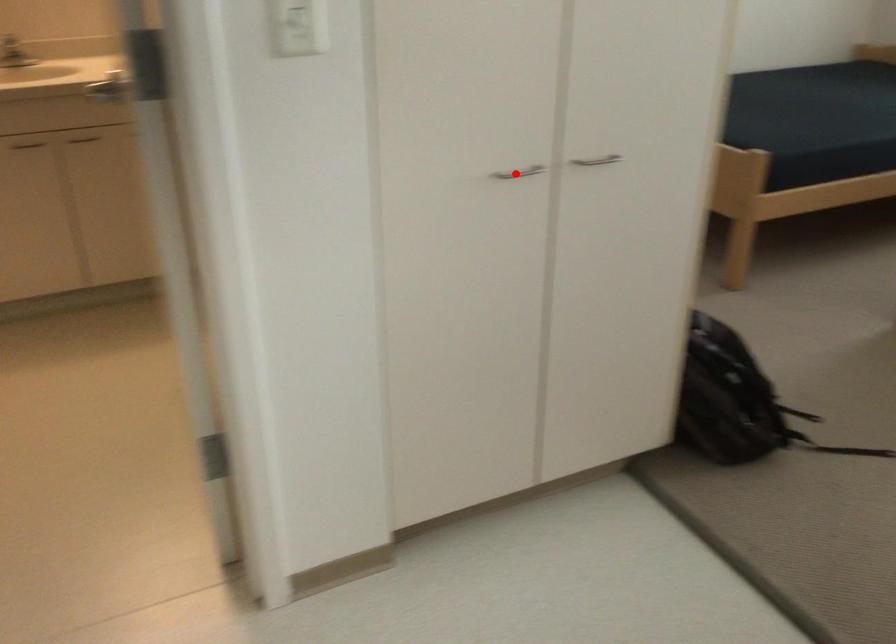
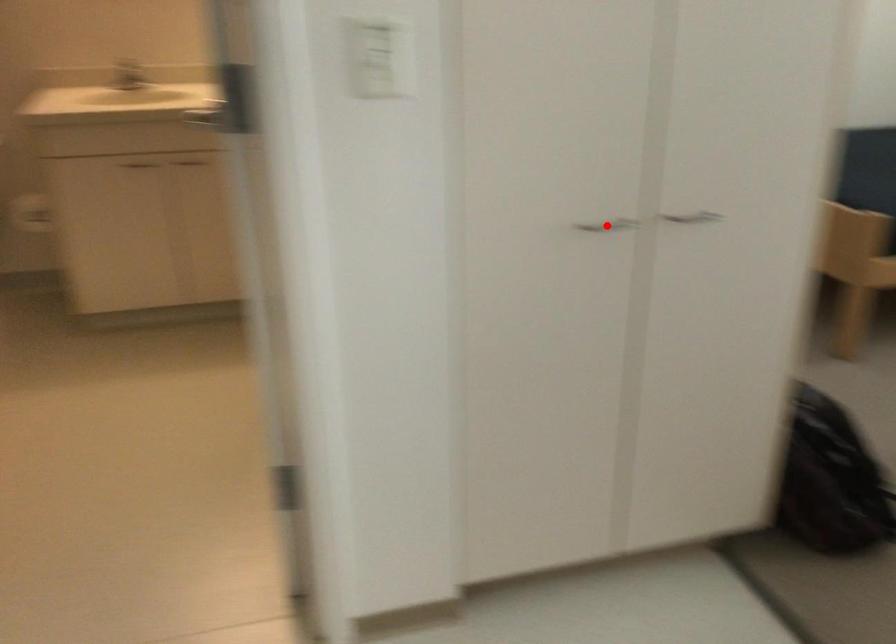
I am providing you with two images of the same scene from different viewpoints. A red point is marked on the first image and another point is marked on the second image. Are the points marked in image1 and image2 representing the same 3D position?

Yes